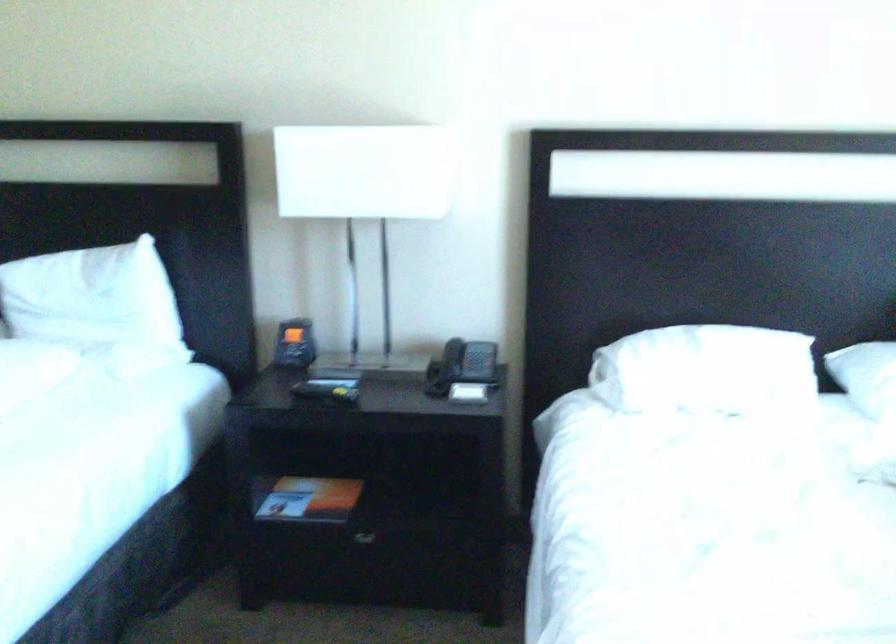
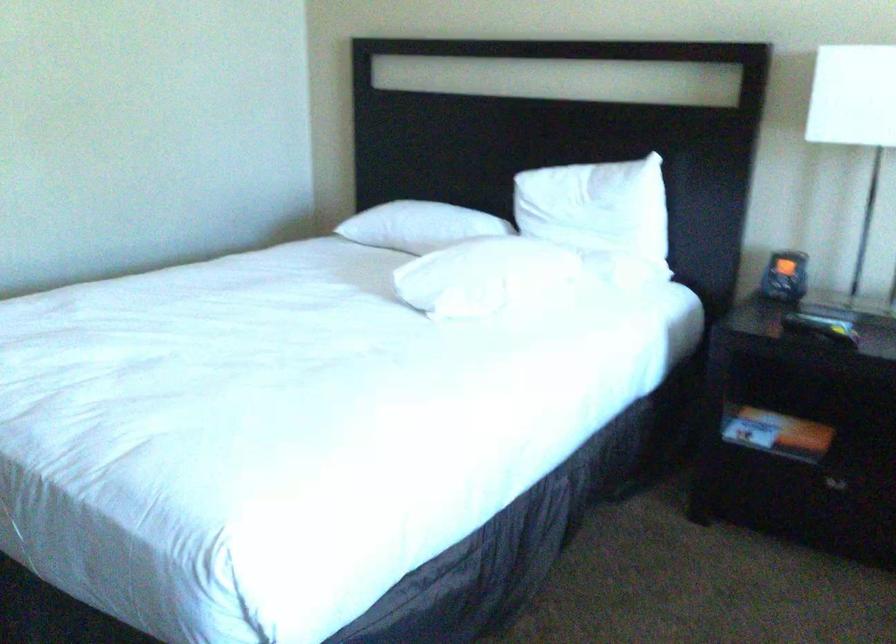
In the second image, find the point that corresponds to point 297,348 in the first image.

(785, 276)